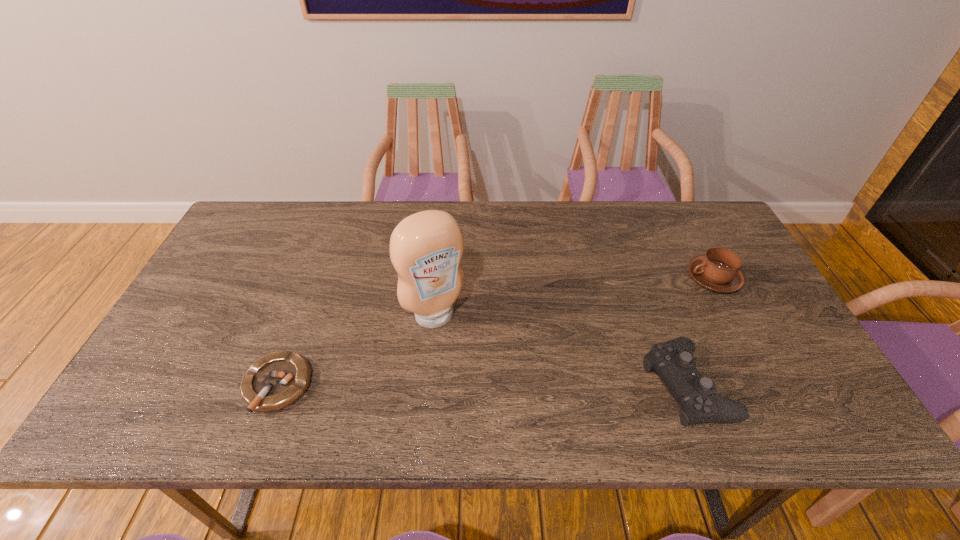
Locate an element on the screen. vacant space situated 0.370m on the side of the rightmost object with the handle is located at coordinates (596, 345).

Identify the location of free region located on the label of the second object from left to right. (468, 364).

Image resolution: width=960 pixels, height=540 pixels. What are the coordinates of `vacant region located 0.100m on the label of the second object from left to right` in the screenshot? It's located at (467, 362).

The image size is (960, 540). I want to click on free point located 0.060m on the label of the second object from left to right, so click(x=459, y=349).

Find the location of a particular element. This screenshot has height=540, width=960. ashtray that is at the near edge is located at coordinates (275, 381).

Image resolution: width=960 pixels, height=540 pixels. I want to click on control that is at the near edge, so click(x=673, y=361).

Where is `object present at the right edge`? Image resolution: width=960 pixels, height=540 pixels. object present at the right edge is located at coordinates (719, 270).

Find the location of `vacant space at the far edge of the desktop`. vacant space at the far edge of the desktop is located at coordinates (498, 228).

Where is `free space at the near edge`? The height and width of the screenshot is (540, 960). free space at the near edge is located at coordinates pos(606,377).

Where is `free space at the far left corner`? free space at the far left corner is located at coordinates (254, 227).